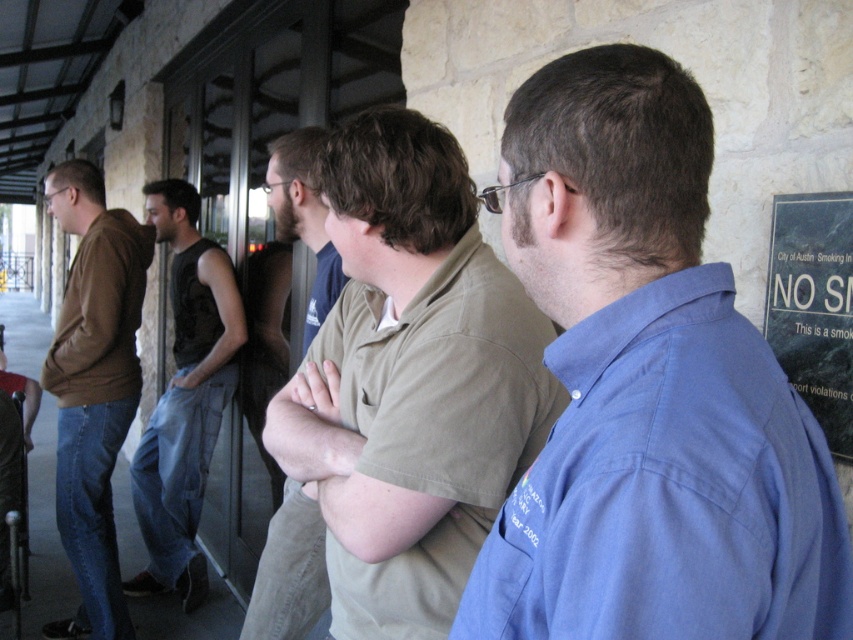
Question: In this image, where is matte brown hoodie at left located relative to dark gray sleeveless shirt at left?

Choices:
 (A) right
 (B) left

Answer: (B)

Question: Does blue cotton shirt at center have a lesser width compared to light brown cotton shirt at center?

Choices:
 (A) no
 (B) yes

Answer: (B)

Question: Which is farther from the light brown cotton shirt at center?

Choices:
 (A) light brown shirt at center
 (B) matte brown hoodie at left

Answer: (B)

Question: Can you confirm if matte brown hoodie at left is positioned below light brown shirt at center?

Choices:
 (A) yes
 (B) no

Answer: (A)

Question: Among these points, which one is nearest to the camera?

Choices:
 (A) (468, 504)
 (B) (581, 442)

Answer: (B)

Question: Which object is the farthest from the light brown cotton shirt at center?

Choices:
 (A) matte brown hoodie at left
 (B) dark gray sleeveless shirt at left
 (C) blue cotton shirt at center

Answer: (B)